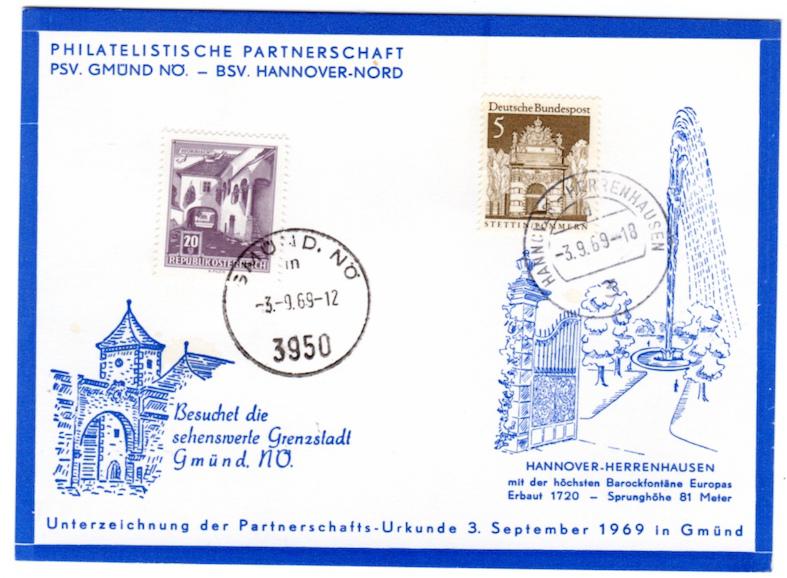
I want to click on windows, so click(146, 361), click(123, 360), click(113, 429).